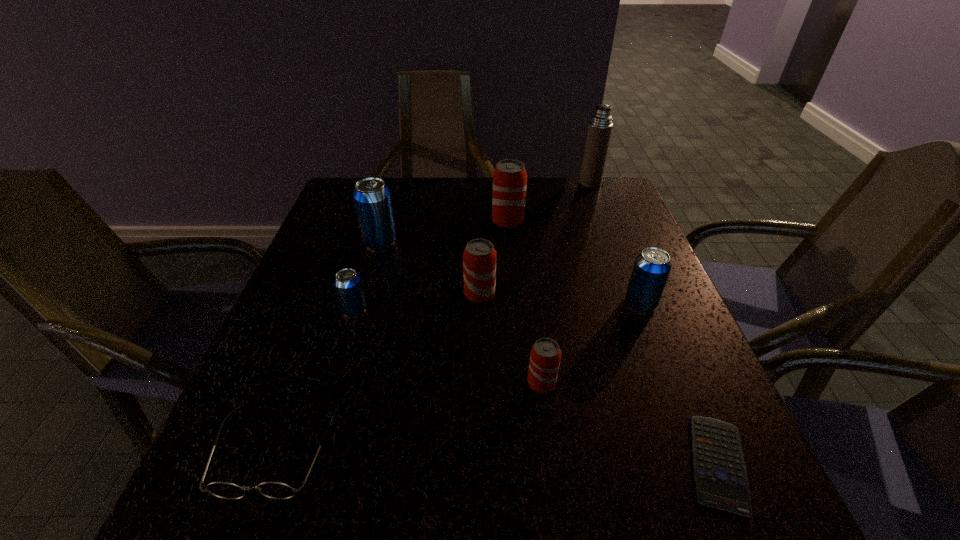
At what (x,y) coordinates should I click in order to perform the action: click on the seventh farthest object. Please return your answer as a coordinate pair (x, y). The width and height of the screenshot is (960, 540). Looking at the image, I should click on (545, 355).

Where is `the smallest orange beer can`? the smallest orange beer can is located at coordinates (545, 355).

Locate an element on the screen. spectacles is located at coordinates (275, 490).

The image size is (960, 540). I want to click on dark spectacles, so click(x=275, y=490).

At what (x,y) coordinates should I click in order to perform the action: click on calculator. Please return your answer as a coordinate pair (x, y). Looking at the image, I should click on (721, 481).

At what (x,y) coordinates should I click in order to perform the action: click on vacant area situated on the left of the farthest object. Please return your answer as a coordinate pair (x, y). Image resolution: width=960 pixels, height=540 pixels. Looking at the image, I should click on (524, 183).

Identify the location of free location located on the front of the farthest orange beer can. The width and height of the screenshot is (960, 540). (512, 270).

What are the coordinates of `vacant region located on the front of the third farthest object` in the screenshot? It's located at [346, 362].

Identify the location of free space located 0.240m on the back of the second biggest orange beer can. (480, 224).

Identify the location of vacant space located 0.400m on the back of the second biggest blue beer can. (600, 199).